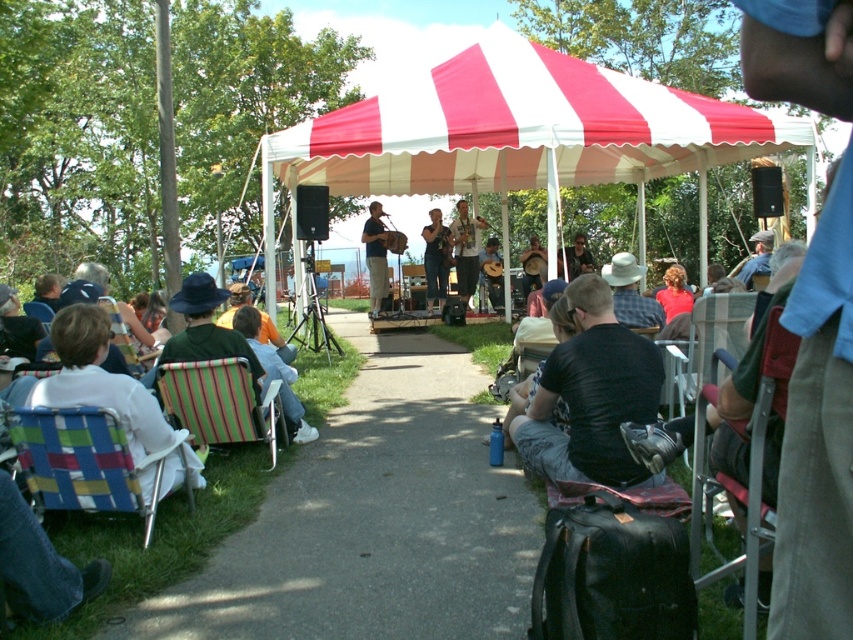
You are a stagehand who needs to place a new microphone stand between the wooden acoustic guitar at center and the blue denim jacket at center. Since the guitar is smaller, where should you position the stand to ensure it doesn

The wooden acoustic guitar at center is smaller than the blue denim jacket at center. To place the microphone stand between them, position it closer to the larger item, the blue denim jacket at center, to maintain balance and avoid overcrowding the smaller guitar.

You are standing at the entrance of the park, which is 100 feet away from the stage. You want to join the audience near the wooden acoustic guitar at center. Can you reach it without walking more than 100 feet?

The wooden acoustic guitar at center is 56.51 feet away from the viewer, so yes, you can reach it without walking more than 100 feet.

You are a stagehand carrying a 1.2 meter wide equipment box and need to place it near the stage. There is a green striped folding chair at lower left and a wooden acoustic guitar at center. Which object should you move to make space, considering their widths?

The green striped folding chair at lower left is wider than the wooden acoustic guitar at center. Since the equipment box is 1.2 meters wide, moving the wider green striped folding chair at lower left would create more space for the box.